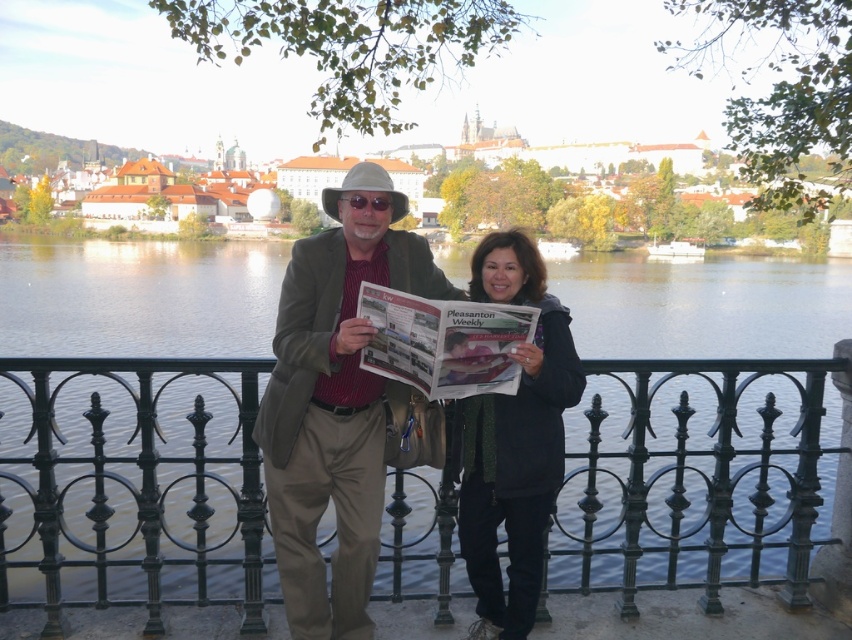
Question: In this image, where is khaki cotton pants at center located relative to dark gray jacket at center?

Choices:
 (A) left
 (B) right

Answer: (A)

Question: Based on their relative distances, which object is nearer to the khaki cotton pants at center?

Choices:
 (A) black wrought iron railing at center
 (B) dark gray jacket at center

Answer: (B)

Question: Which point is closer to the camera taking this photo?

Choices:
 (A) 275,426
 (B) 540,532
 (C) 239,410

Answer: (A)

Question: Does black wrought iron railing at center appear on the left side of khaki cotton pants at center?

Choices:
 (A) yes
 (B) no

Answer: (B)

Question: Does black wrought iron railing at center appear under khaki cotton pants at center?

Choices:
 (A) no
 (B) yes

Answer: (B)

Question: Estimate the real-world distances between objects in this image. Which object is farther from the dark gray jacket at center?

Choices:
 (A) black wrought iron railing at center
 (B) khaki cotton pants at center

Answer: (A)